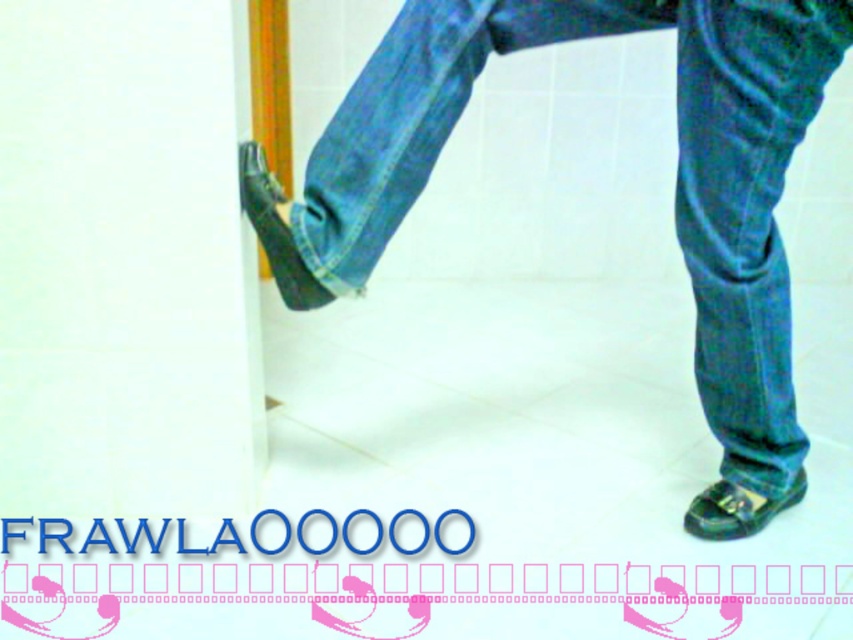
Does point (697, 64) come in front of point (746, 532)?

That is True.

Can you confirm if denim at left is wider than green leather shoe at lower right?

Indeed, denim at left has a greater width compared to green leather shoe at lower right.

Is point (422, 36) closer to camera compared to point (721, 522)?

Yes, point (422, 36) is closer to viewer.

Where is `denim at left`? This screenshot has height=640, width=853. denim at left is located at coordinates (675, 180).

Is denim at left wider than matte black shoe at lower left?

Yes.

Who is higher up, denim at left or matte black shoe at lower left?

denim at left

Which is in front, point (303, 193) or point (244, 188)?

Point (244, 188)

Identify the location of denim at left. The image size is (853, 640). (675, 180).

Is matte black shoe at lower left taller than green leather shoe at lower right?

Yes, matte black shoe at lower left is taller than green leather shoe at lower right.

Locate an element on the screen. Image resolution: width=853 pixels, height=640 pixels. matte black shoe at lower left is located at coordinates (276, 230).